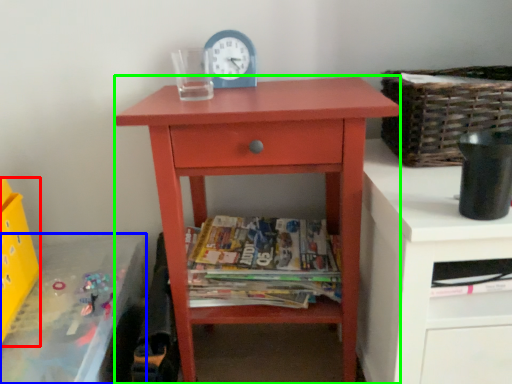
Question: Which object is positioned closest to crate (highlighted by a red box)? Select from changing table (highlighted by a blue box) and nightstand (highlighted by a green box).

Choices:
 (A) changing table
 (B) nightstand

Answer: (A)